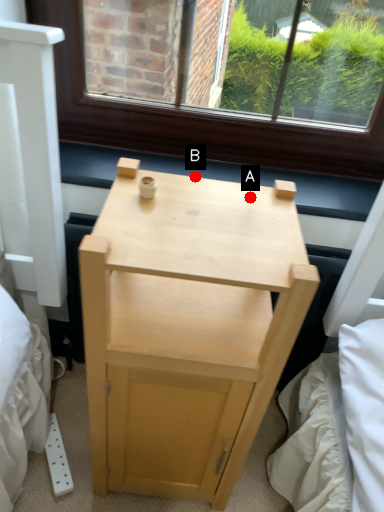
Question: Two points are circled on the image, labeled by A and B beside each circle. Among these points, which one is nearest to the camera?

Choices:
 (A) A is closer
 (B) B is closer

Answer: (A)